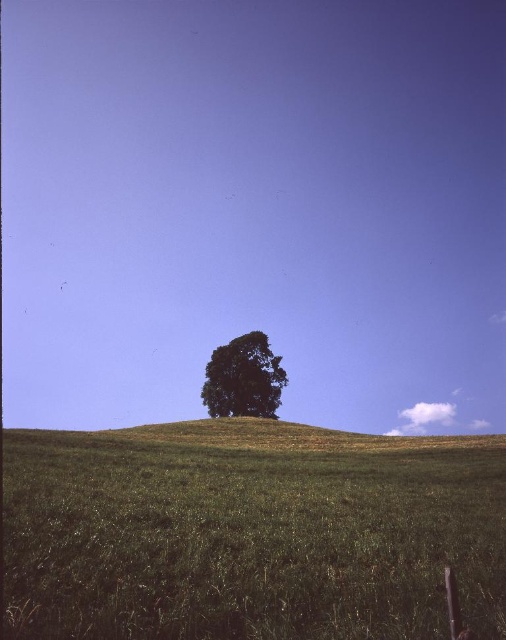
Looking at this image, you are a hiker standing at the base of the green grassy hill at center and the green leafy tree at center. Which one do you need to climb to reach the top?

The green leafy tree at center is narrower than the green grassy hill at center, so you should climb the green leafy tree at center to reach the top faster.

You are standing at the base of the green leafy tree at center and want to walk to the green grassy hill at center. In which direction should you head?

The green grassy hill at center is positioned on the right side of green leafy tree at center, so you should head to the right to reach it.

You are a hiker standing at the base of the green grassy hill at center and want to climb to the top where the green leafy tree at center is located. Which direction should you go to reach the tree?

The green leafy tree at center is located at the top of the green grassy hill at center, so you should climb upwards towards the top of the green grassy hill at center to reach the tree.